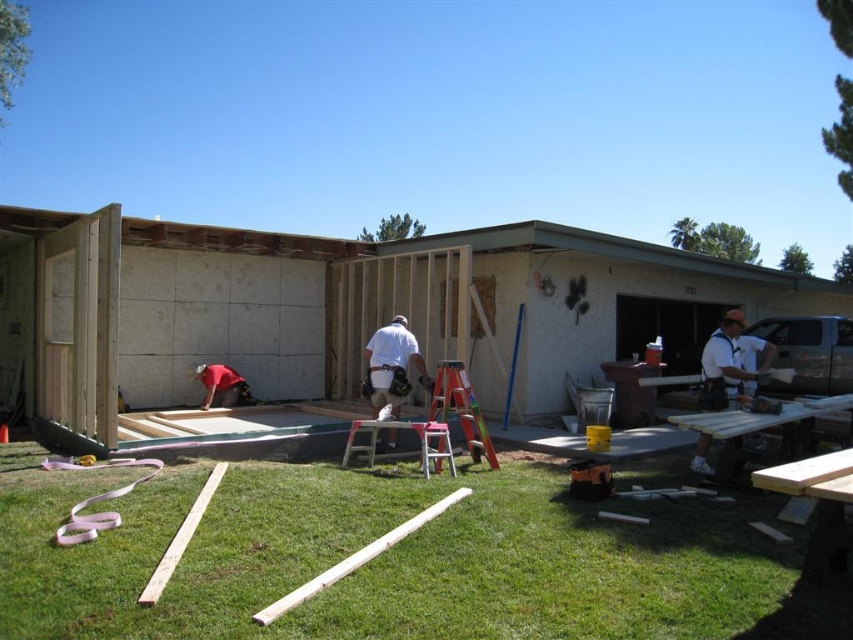
Who is taller, white smooth shirt at right or orange fiberglass ladder at center?

orange fiberglass ladder at center is taller.

Find the location of a particular element. This screenshot has width=853, height=640. white smooth shirt at right is located at coordinates (729, 362).

Identify the location of white smooth shirt at right. The width and height of the screenshot is (853, 640). (729, 362).

Which is behind, point (448, 371) or point (201, 381)?

The point (201, 381) is behind.

Who is positioned more to the left, orange fiberglass ladder at center or red fabric construction worker at lower left?

From the viewer's perspective, red fabric construction worker at lower left appears more on the left side.

Who is more forward, [462,417] or [231,374]?

Point [462,417] is in front.

You are a GUI agent. You are given a task and a screenshot of the screen. Output one action in this format:
    pyautogui.click(x=<x>, y=<y>)
    Task: Click on the orange fiberglass ladder at center
    This screenshot has height=640, width=853.
    Given the screenshot: What is the action you would take?
    pyautogui.click(x=460, y=408)

Is point (746, 323) behind point (241, 390)?

No, it is in front of (241, 390).

Between white smooth shirt at right and red fabric construction worker at lower left, which one appears on the right side from the viewer's perspective?

Positioned to the right is white smooth shirt at right.

Is point (764, 348) positioned behind point (212, 380)?

No, (764, 348) is in front of (212, 380).

You are a GUI agent. You are given a task and a screenshot of the screen. Output one action in this format:
    pyautogui.click(x=<x>, y=<y>)
    Task: Click on the white smooth shirt at right
    
    Given the screenshot: What is the action you would take?
    pyautogui.click(x=729, y=362)